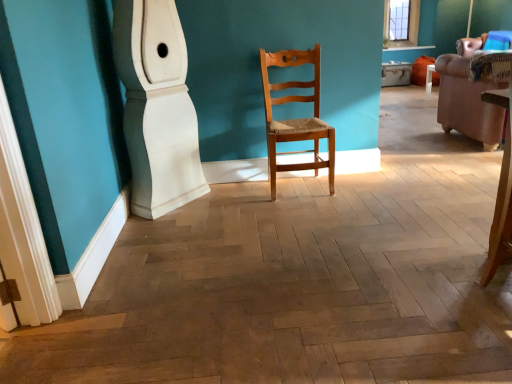
Question: Is brown leather armchair at right completely or partially outside of natural wood chair at center?

Choices:
 (A) yes
 (B) no

Answer: (A)

Question: Is the depth of brown leather armchair at right less than that of natural wood chair at center?

Choices:
 (A) no
 (B) yes

Answer: (A)

Question: Is brown leather armchair at right beside natural wood chair at center?

Choices:
 (A) no
 (B) yes

Answer: (A)

Question: From the image's perspective, does brown leather armchair at right appear lower than natural wood chair at center?

Choices:
 (A) no
 (B) yes

Answer: (A)

Question: Is brown leather armchair at right at the right side of natural wood chair at center?

Choices:
 (A) yes
 (B) no

Answer: (A)

Question: Looking at their shapes, would you say brown leather armchair at right is wider or thinner than natural wood chair at center?

Choices:
 (A) wide
 (B) thin

Answer: (A)

Question: Does point (498, 125) appear closer or farther from the camera than point (270, 62)?

Choices:
 (A) closer
 (B) farther

Answer: (B)

Question: Is brown leather armchair at right bigger or smaller than natural wood chair at center?

Choices:
 (A) big
 (B) small

Answer: (A)

Question: From a real-world perspective, is brown leather armchair at right positioned above or below natural wood chair at center?

Choices:
 (A) above
 (B) below

Answer: (B)

Question: In terms of height, does white glossy baseboard at lower left look taller or shorter compared to natural wood chair at center?

Choices:
 (A) short
 (B) tall

Answer: (B)

Question: Considering the positions of white glossy baseboard at lower left and natural wood chair at center in the image, is white glossy baseboard at lower left bigger or smaller than natural wood chair at center?

Choices:
 (A) big
 (B) small

Answer: (A)

Question: Considering the relative positions of white glossy baseboard at lower left and natural wood chair at center in the image provided, is white glossy baseboard at lower left to the left or to the right of natural wood chair at center?

Choices:
 (A) left
 (B) right

Answer: (A)

Question: Looking at their shapes, would you say white glossy baseboard at lower left is wider or thinner than natural wood chair at center?

Choices:
 (A) thin
 (B) wide

Answer: (B)

Question: Would you say natural wood chair at center is to the left or to the right of white glossy baseboard at lower left in the picture?

Choices:
 (A) right
 (B) left

Answer: (A)

Question: Based on their sizes in the image, would you say natural wood chair at center is bigger or smaller than white glossy baseboard at lower left?

Choices:
 (A) small
 (B) big

Answer: (A)